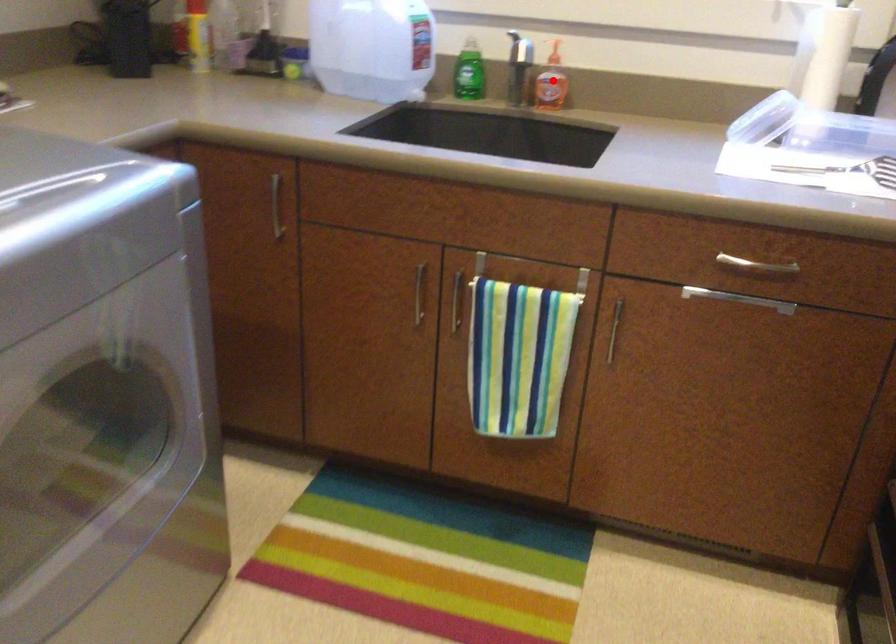
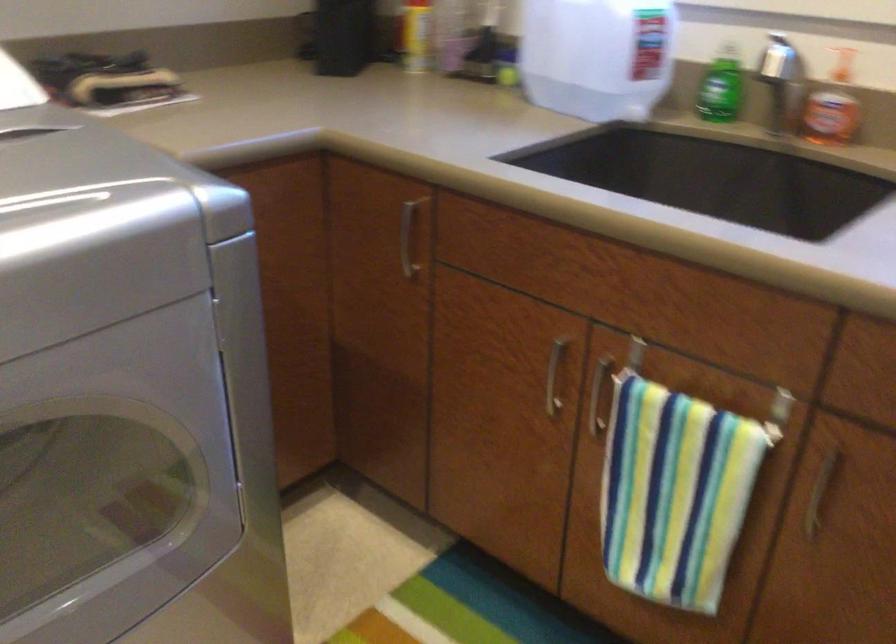
In the second image, find the point that corresponds to the highlighted location in the first image.

(832, 106)